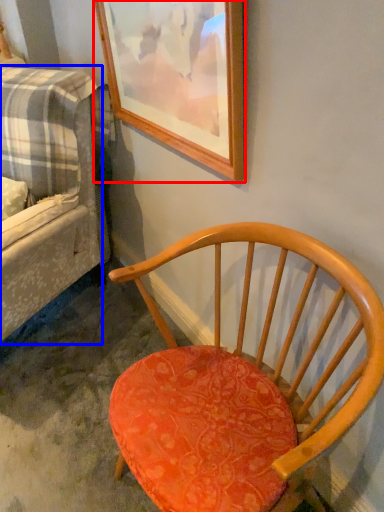
Question: Which object is further to the camera taking this photo, picture frame (highlighted by a red box) or studio couch (highlighted by a blue box)?

Choices:
 (A) picture frame
 (B) studio couch

Answer: (B)